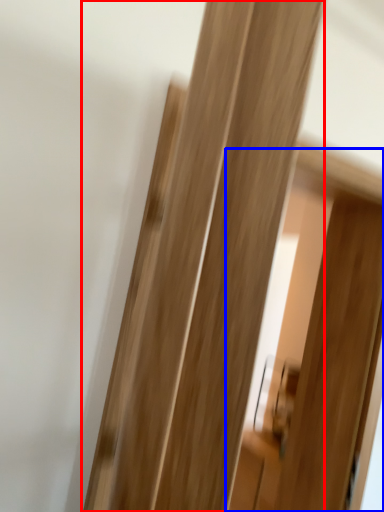
Question: Among these objects, which one is nearest to the camera, door (highlighted by a red box) or screen door (highlighted by a blue box)?

Choices:
 (A) door
 (B) screen door

Answer: (A)